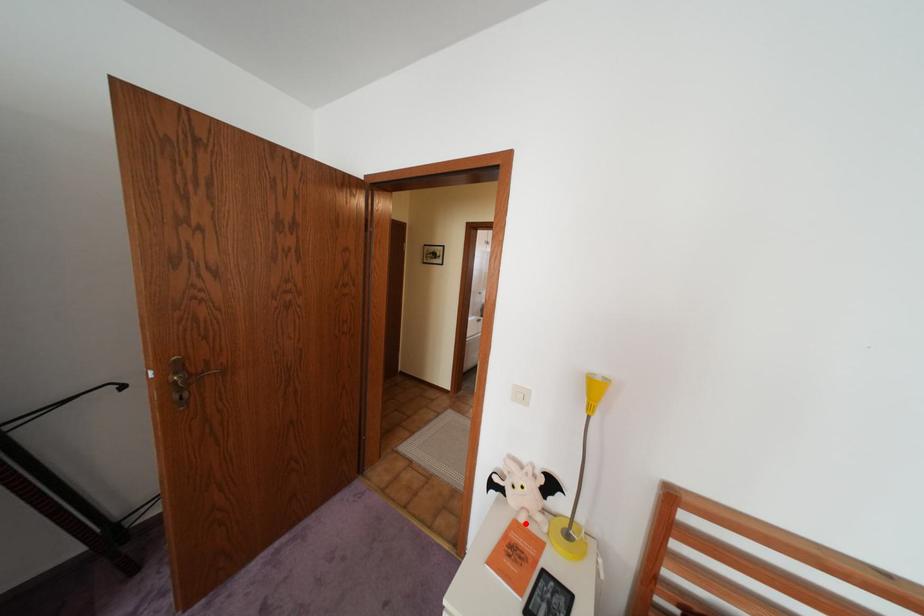
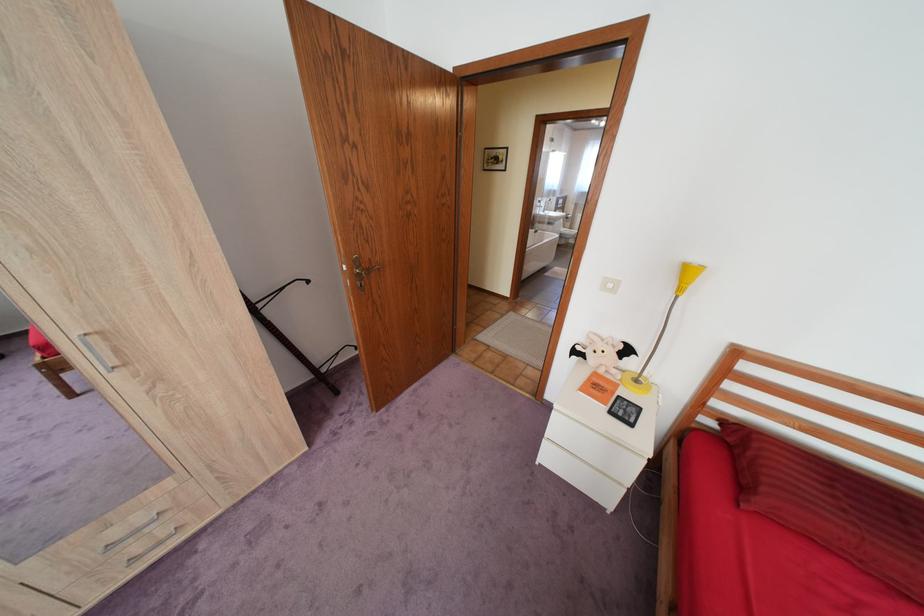
Find the pixel in the second image that matches the highlighted location in the first image.

(606, 373)